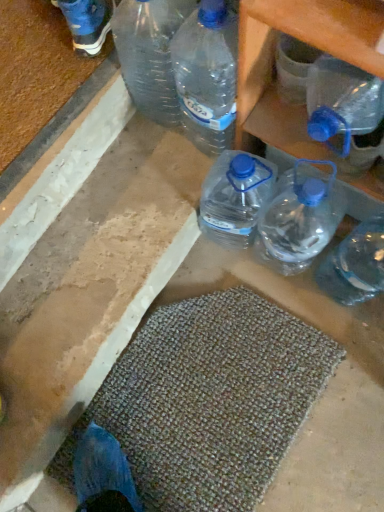
Question: Is transparent plastic bottles at upper right positioned in front of transparent plastic bottle at upper right, which is the 1th bottle in front-to-back order?

Choices:
 (A) no
 (B) yes

Answer: (A)

Question: Is transparent plastic bottles at upper right further to camera compared to transparent plastic bottle at upper right, which is the 1th bottle in front-to-back order?

Choices:
 (A) yes
 (B) no

Answer: (A)

Question: Does transparent plastic bottles at upper right have a larger size compared to transparent plastic bottle at upper right, which is the 1th bottle in front-to-back order?

Choices:
 (A) yes
 (B) no

Answer: (A)

Question: Is transparent plastic bottles at upper right turned away from transparent plastic bottle at upper right, which is the 1th bottle in front-to-back order?

Choices:
 (A) yes
 (B) no

Answer: (B)

Question: Can you confirm if transparent plastic bottles at upper right is smaller than transparent plastic bottle at upper right, which is the 1th bottle in front-to-back order?

Choices:
 (A) yes
 (B) no

Answer: (B)

Question: Could you tell me if transparent plastic bottles at upper right is facing transparent plastic bottle at upper right, the second bottle in the back-to-front sequence?

Choices:
 (A) yes
 (B) no

Answer: (B)

Question: Does transparent plastic bottle at upper right, the second bottle in the back-to-front sequence, have a lesser width compared to transparent plastic bottles at upper right?

Choices:
 (A) yes
 (B) no

Answer: (A)

Question: Is transparent plastic bottle at upper right, which is the 1th bottle in front-to-back order, to the right of transparent plastic bottles at upper right from the viewer's perspective?

Choices:
 (A) yes
 (B) no

Answer: (A)

Question: Is transparent plastic bottle at upper right, which is the 1th bottle in front-to-back order, further to camera compared to transparent plastic bottles at upper right?

Choices:
 (A) yes
 (B) no

Answer: (B)

Question: Does transparent plastic bottle at upper right, the second bottle in the back-to-front sequence, contain transparent plastic bottles at upper right?

Choices:
 (A) no
 (B) yes

Answer: (A)

Question: From a real-world perspective, is transparent plastic bottle at upper right, the second bottle in the back-to-front sequence, under transparent plastic bottles at upper right?

Choices:
 (A) no
 (B) yes

Answer: (A)

Question: Is transparent plastic bottle at upper right, which is the 1th bottle in front-to-back order, next to transparent plastic bottles at upper right and touching it?

Choices:
 (A) no
 (B) yes

Answer: (B)

Question: Is transparent plastic bottle at right, the first bottle viewed from the back, in front of transparent plastic bottle at upper right, the second bottle in the back-to-front sequence?

Choices:
 (A) no
 (B) yes

Answer: (A)